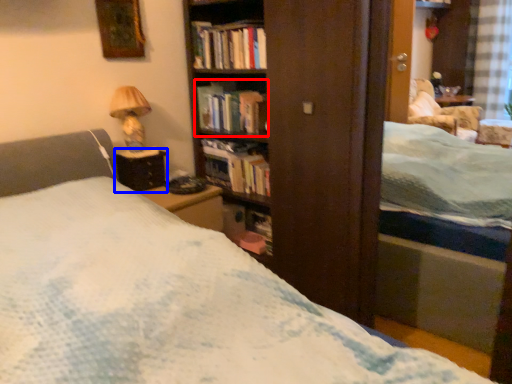
Question: Among these objects, which one is nearest to the camera, book (highlighted by a red box) or table (highlighted by a blue box)?

Choices:
 (A) book
 (B) table

Answer: (B)